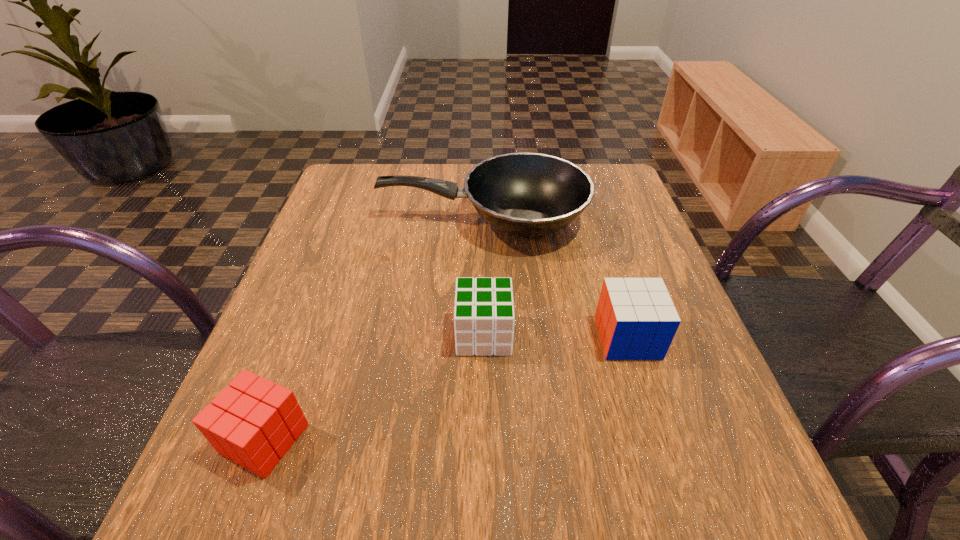
You are a GUI agent. You are given a task and a screenshot of the screen. Output one action in this format:
    pyautogui.click(x=<x>, y=<y>)
    Task: Click on the free point that satisfies the following two spatial constraints: 1. on the red face of the second cube from right to left; 2. on the right side of the rightmost cube
    The image size is (960, 540).
    Given the screenshot: What is the action you would take?
    pyautogui.click(x=484, y=338)